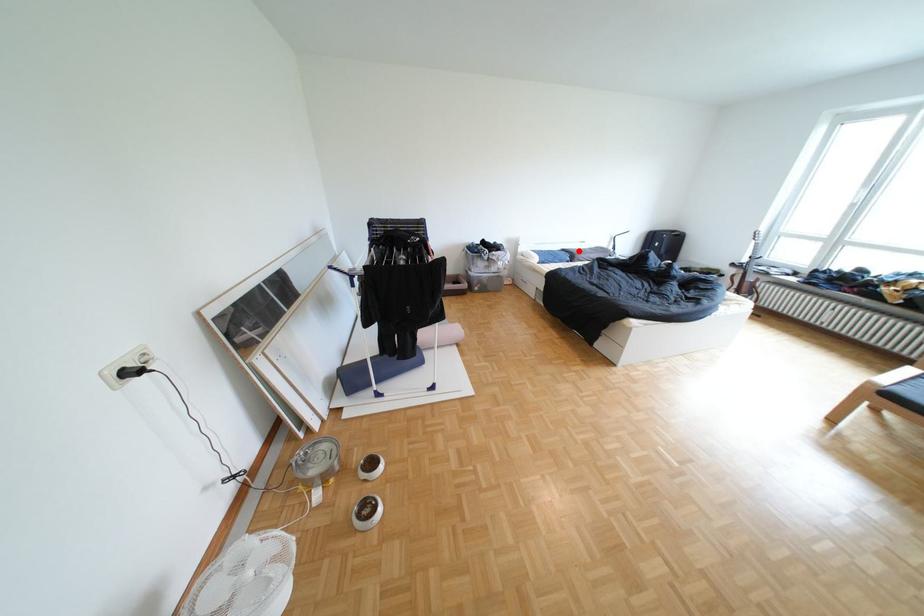
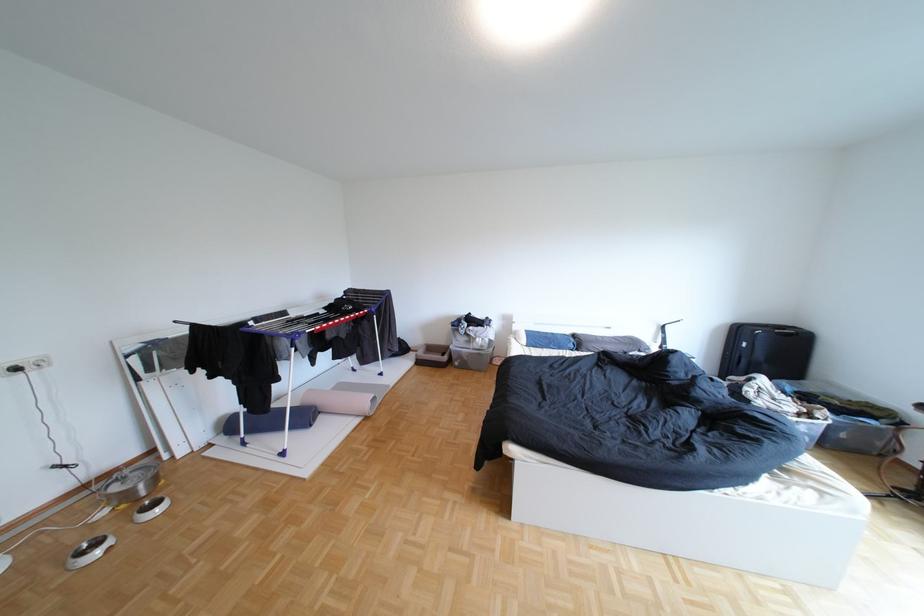
Find the pixel in the second image that matches the highlighted location in the first image.

(590, 336)